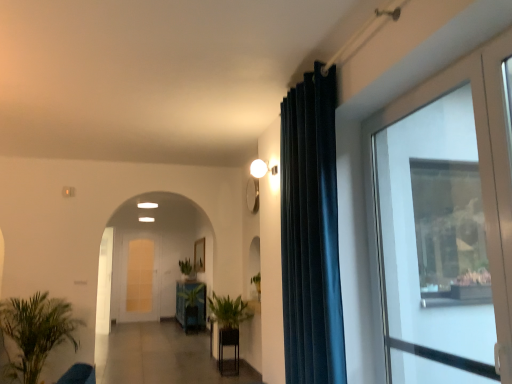
I want to click on empty space that is ontop of transparent glass door at right, so (x=419, y=89).